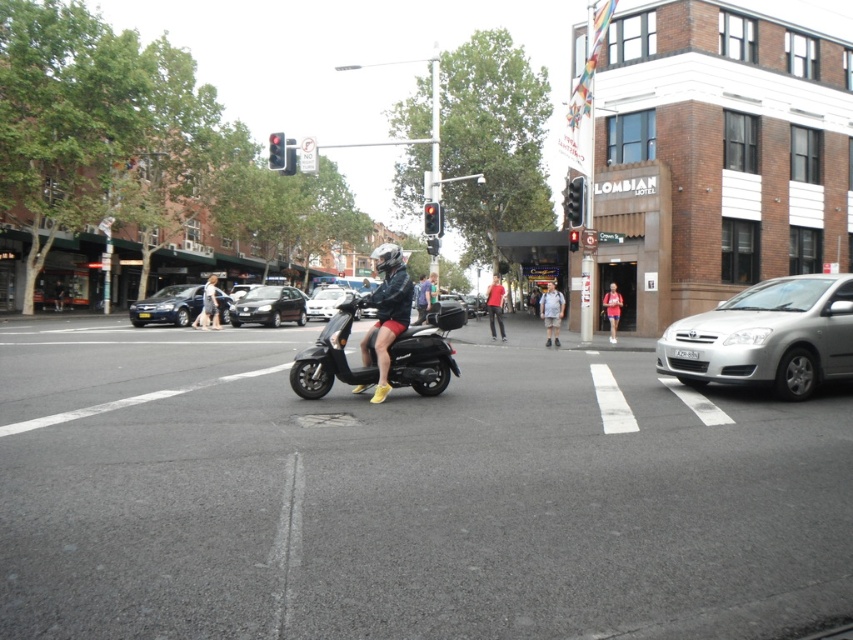
You are a delivery driver who needs to stop at the black plastic traffic light at upper center. Your delivery package is currently on the denim jacket at center. Can you reach the traffic light without moving the package?

The black plastic traffic light at upper center is 8.07 meters away from the denim jacket at center. Since the package is on the denim jacket at center, you would need to move it to the traffic light location, which is 8.07 meters away. Therefore, you cannot reach the traffic light without moving the package.

You are a pedestrian standing at the crosswalk. You want to reach the black plastic traffic light at upper center. The light gray cotton shirt at center is blocking your path. Can you walk around them without getting too close? The minimum safe distance is 1 meter.

The distance between the light gray cotton shirt at center and the black plastic traffic light at upper center is 3.56 meters. Since the minimum safe distance is 1 meter, you can walk around the light gray cotton shirt at center while maintaining a safe distance of at least 1 meter from them.